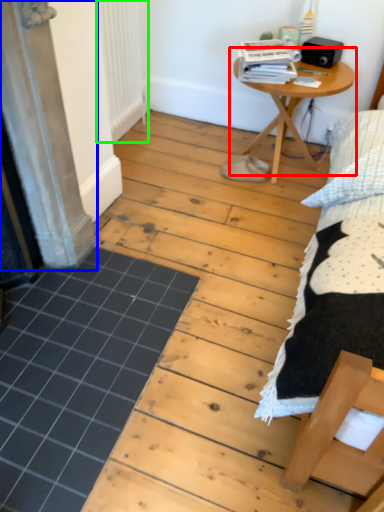
Question: Estimate the real-world distances between objects in this image. Which object is closer to table (highlighted by a red box), screen door (highlighted by a blue box) or radiator (highlighted by a green box)?

Choices:
 (A) screen door
 (B) radiator

Answer: (B)